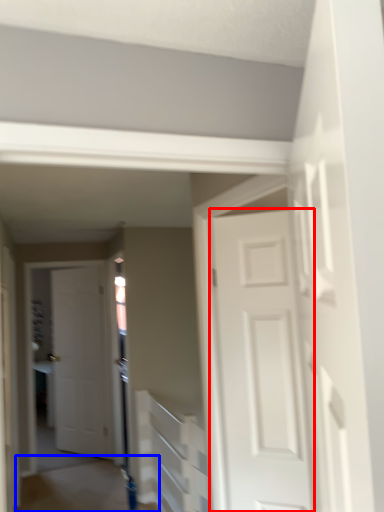
Question: Which of the following is the farthest to the observer, door (highlighted by a red box) or path (highlighted by a blue box)?

Choices:
 (A) door
 (B) path

Answer: (B)